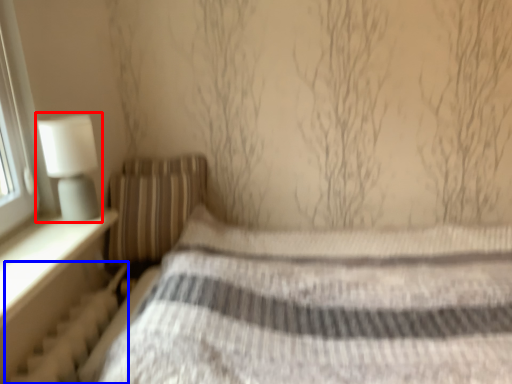
Question: Which of the following is the farthest to the observer, table lamp (highlighted by a red box) or radiator (highlighted by a blue box)?

Choices:
 (A) table lamp
 (B) radiator

Answer: (A)